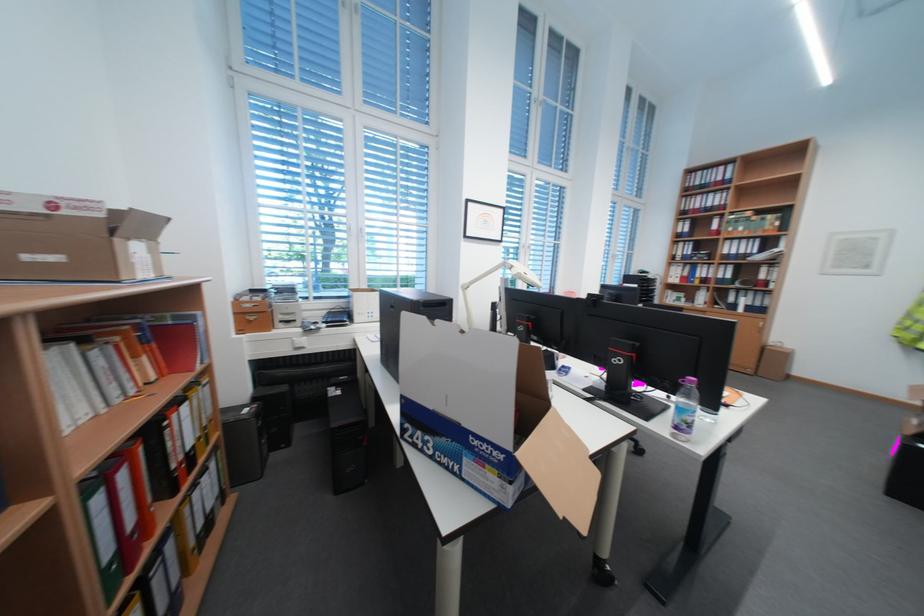
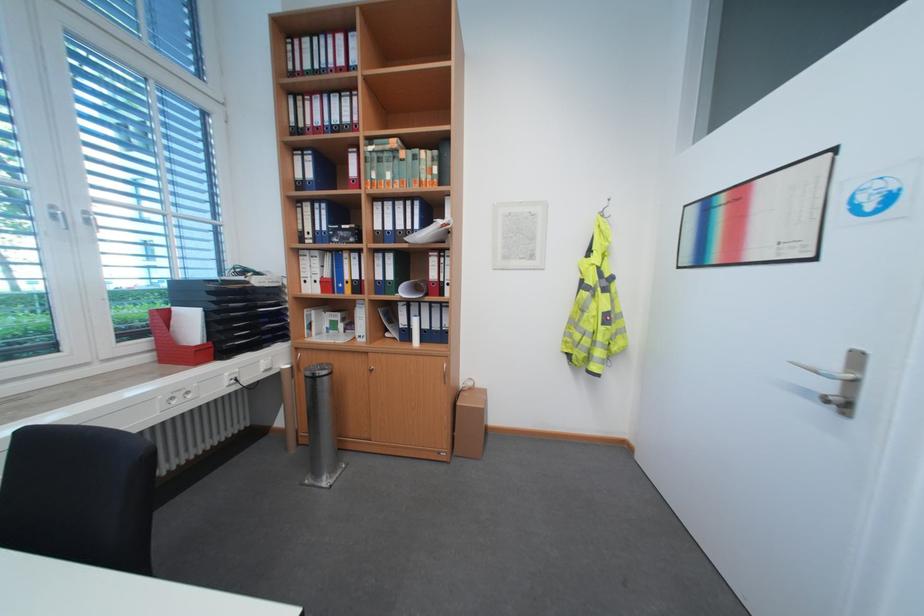
The point at (782, 345) is marked in the first image. Where is the corresponding point in the second image?

(472, 387)